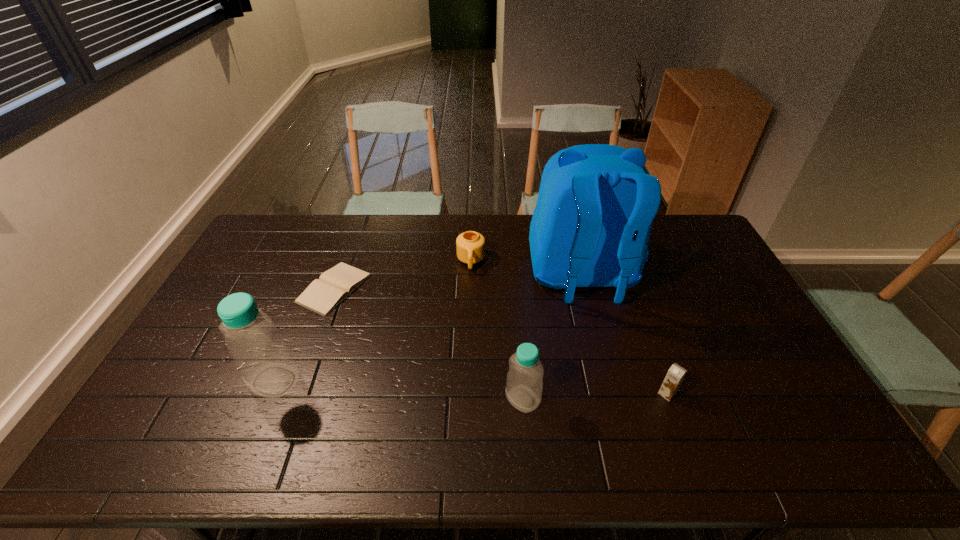
Please point out where to position a new bottle on the right to maintain spacing. Please provide its 2D coordinates. Your answer should be formatted as a tuple, i.e. [(x, y)], where the tuple contains the x and y coordinates of a point satisfying the conditions above.

[(790, 418)]